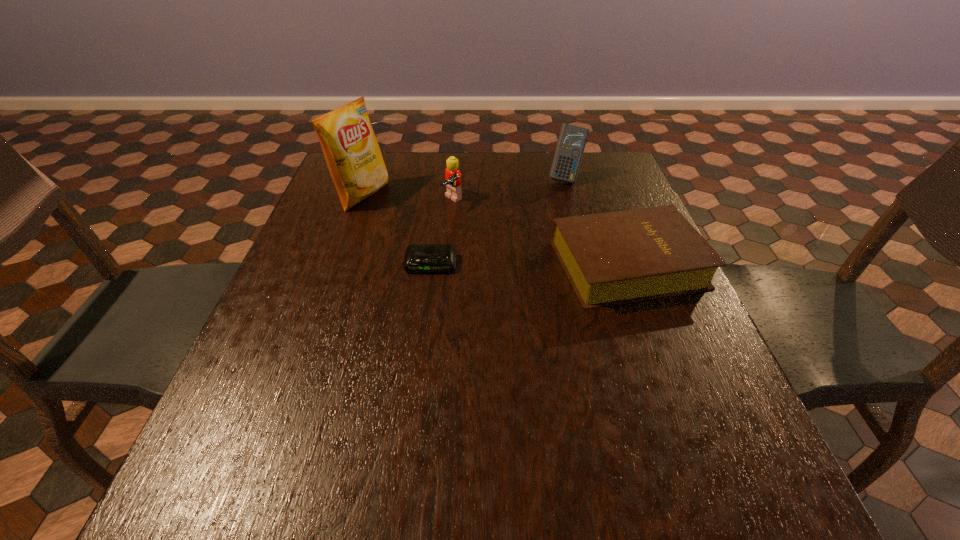
Identify the location of the shortest object. (419, 258).

Locate an element on the screen. This screenshot has height=540, width=960. Bible is located at coordinates (611, 258).

Where is `crisp (potato chip)`? The height and width of the screenshot is (540, 960). crisp (potato chip) is located at coordinates (353, 156).

Locate an element on the screen. Image resolution: width=960 pixels, height=540 pixels. the leftmost object is located at coordinates (353, 156).

Identify the location of calculator. (572, 139).

Where is `the third tallest object`? The width and height of the screenshot is (960, 540). the third tallest object is located at coordinates (453, 182).

Where is `vacant area situated 0.320m on the display of the shortest object`? The height and width of the screenshot is (540, 960). vacant area situated 0.320m on the display of the shortest object is located at coordinates (415, 397).

The height and width of the screenshot is (540, 960). Identify the location of free location located 0.300m on the back of the Bible. (592, 169).

Locate an element on the screen. vacant space situated on the front-facing side of the leftmost object is located at coordinates (414, 217).

The image size is (960, 540). Identify the location of free space located on the front-facing side of the leftmost object. [x=469, y=239].